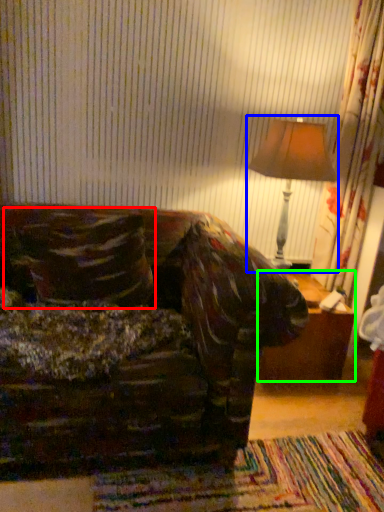
Question: Which object is the farthest from throw pillow (highlighted by a red box)? Choose among these: table lamp (highlighted by a blue box) or table (highlighted by a green box).

Choices:
 (A) table lamp
 (B) table

Answer: (B)